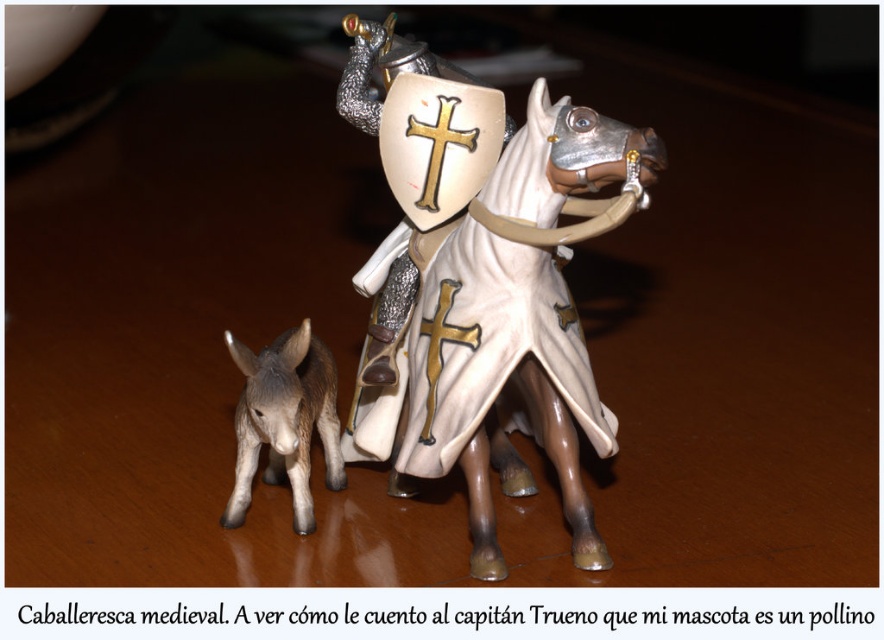
Question: Where is white glossy plastic horse at center located in relation to brown matte donkey at lower left in the image?

Choices:
 (A) right
 (B) left

Answer: (A)

Question: Is white glossy plastic horse at center positioned behind brown matte donkey at lower left?

Choices:
 (A) no
 (B) yes

Answer: (A)

Question: Which point is closer to the camera?

Choices:
 (A) brown matte donkey at lower left
 (B) white glossy plastic horse at center

Answer: (B)

Question: Is white glossy plastic horse at center thinner than brown matte donkey at lower left?

Choices:
 (A) no
 (B) yes

Answer: (A)

Question: Which of the following is the closest to the observer?

Choices:
 (A) white glossy plastic horse at center
 (B) brown matte donkey at lower left

Answer: (A)

Question: Which point appears closest to the camera in this image?

Choices:
 (A) (257, 392)
 (B) (663, 164)

Answer: (B)